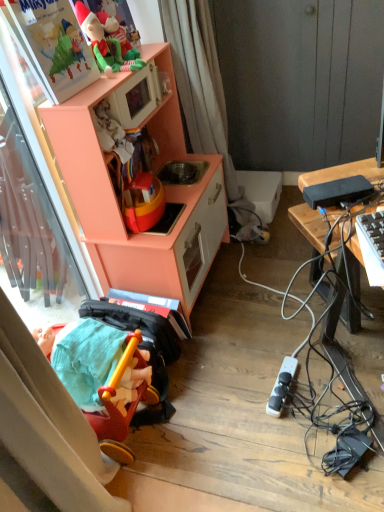
Question: Considering the relative sizes of matte plastic elf at upper left, which is counted as the 1th toy, starting from the top, and peach wood toy kitchen at left in the image provided, is matte plastic elf at upper left, which is counted as the 1th toy, starting from the top, taller than peach wood toy kitchen at left?

Choices:
 (A) no
 (B) yes

Answer: (A)

Question: Is matte plastic elf at upper left, the 2th toy ordered from the bottom, facing towards peach wood toy kitchen at left?

Choices:
 (A) no
 (B) yes

Answer: (A)

Question: Is the depth of matte plastic elf at upper left, which is counted as the 1th toy, starting from the top, less than that of peach wood toy kitchen at left?

Choices:
 (A) yes
 (B) no

Answer: (B)

Question: Can you confirm if matte plastic elf at upper left, which is counted as the 1th toy, starting from the top, is bigger than peach wood toy kitchen at left?

Choices:
 (A) no
 (B) yes

Answer: (A)

Question: Is peach wood toy kitchen at left completely or partially inside matte plastic elf at upper left, the 2th toy ordered from the bottom?

Choices:
 (A) yes
 (B) no

Answer: (B)

Question: Considering their positions, is black plastic desk at right located in front of or behind black plastic power bank at right, the second appliance when ordered from back to front?

Choices:
 (A) behind
 (B) front

Answer: (A)

Question: Considering the relative positions of black plastic desk at right and black plastic power bank at right, acting as the second appliance starting from the bottom, in the image provided, is black plastic desk at right to the left or to the right of black plastic power bank at right, acting as the second appliance starting from the bottom,?

Choices:
 (A) left
 (B) right

Answer: (B)

Question: Considering the positions of black plastic desk at right and black plastic power bank at right, the second appliance when ordered from back to front, in the image, is black plastic desk at right taller or shorter than black plastic power bank at right, the second appliance when ordered from back to front,?

Choices:
 (A) tall
 (B) short

Answer: (A)

Question: Is black plastic desk at right inside the boundaries of black plastic power bank at right, the first appliance positioned from the front, or outside?

Choices:
 (A) outside
 (B) inside

Answer: (A)

Question: Is point (188, 92) closer or farther from the camera than point (86, 228)?

Choices:
 (A) closer
 (B) farther

Answer: (B)

Question: Considering the relative positions of white fabric curtain at upper center and peach wood toy kitchen at left in the image provided, is white fabric curtain at upper center to the left or to the right of peach wood toy kitchen at left?

Choices:
 (A) right
 (B) left

Answer: (A)

Question: Considering the positions of white fabric curtain at upper center and peach wood toy kitchen at left in the image, is white fabric curtain at upper center wider or thinner than peach wood toy kitchen at left?

Choices:
 (A) thin
 (B) wide

Answer: (A)

Question: Is white fabric curtain at upper center situated inside peach wood toy kitchen at left or outside?

Choices:
 (A) outside
 (B) inside

Answer: (A)

Question: In terms of width, does white fabric curtain at upper center look wider or thinner when compared to rubberized red tricycle at lower left, the 1th toy when ordered from bottom to top?

Choices:
 (A) thin
 (B) wide

Answer: (A)

Question: Considering the positions of white fabric curtain at upper center and rubberized red tricycle at lower left, the 1th toy when ordered from bottom to top, in the image, is white fabric curtain at upper center bigger or smaller than rubberized red tricycle at lower left, the 1th toy when ordered from bottom to top,?

Choices:
 (A) small
 (B) big

Answer: (B)